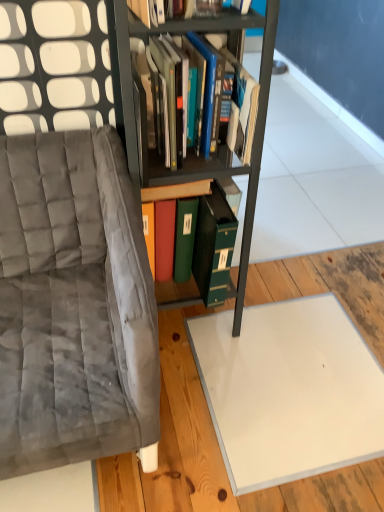
Describe the element at coordinates (167, 200) in the screenshot. I see `green matte file at center, the second book viewed from the top` at that location.

What do you see at coordinates (188, 153) in the screenshot? The image size is (384, 512). I see `metallic black bookcase at center` at bounding box center [188, 153].

Find the location of `metallic black bookcase at center`. metallic black bookcase at center is located at coordinates (188, 153).

You are a GUI agent. You are given a task and a screenshot of the screen. Output one action in this format:
    pyautogui.click(x=<x>, y=<y>)
    Task: Click on the hardcover books at center, which ranks as the second book in bottom-to-top order
    This screenshot has height=512, width=384.
    Given the screenshot: What is the action you would take?
    pyautogui.click(x=236, y=99)

At what (x,y) coordinates should I click in order to perform the action: click on green matte file at center, the 1th book in the bottom-to-top sequence. Please return your answer as a coordinate pair (x, y). Looking at the image, I should click on 167,200.

Is point (160, 177) behind point (151, 204)?

No, it is in front of (151, 204).

Considering the relative sizes of metallic black bookcase at center and green matte file at center, the second book viewed from the top, in the image provided, is metallic black bookcase at center taller than green matte file at center, the second book viewed from the top,?

Correct, metallic black bookcase at center is much taller as green matte file at center, the second book viewed from the top.

Consider the image. From a real-world perspective, is metallic black bookcase at center located beneath green matte file at center, the 1th book in the bottom-to-top sequence?

Incorrect, from a real-world perspective, metallic black bookcase at center is higher than green matte file at center, the 1th book in the bottom-to-top sequence.

Can you confirm if green matte file at center, the second book viewed from the top, is thinner than hardcover books at center, which ranks as the second book in bottom-to-top order?

Incorrect, the width of green matte file at center, the second book viewed from the top, is not less than that of hardcover books at center, which ranks as the second book in bottom-to-top order.

Does green matte file at center, the second book viewed from the top, have a greater height compared to hardcover books at center, which ranks as the second book in bottom-to-top order?

Result: Yes, green matte file at center, the second book viewed from the top, is taller than hardcover books at center, which ranks as the second book in bottom-to-top order.

How many degrees apart are the facing directions of green matte file at center, the 1th book in the bottom-to-top sequence, and hardcover books at center, the 1th book in the top-to-bottom sequence?

The facing directions of green matte file at center, the 1th book in the bottom-to-top sequence, and hardcover books at center, the 1th book in the top-to-bottom sequence, are 0.000184 degrees apart.

Can you see green matte file at center, the second book viewed from the top, touching hardcover books at center, the 1th book in the top-to-bottom sequence?

green matte file at center, the second book viewed from the top, is not next to hardcover books at center, the 1th book in the top-to-bottom sequence, and they're not touching.

Is metallic black bookcase at center directly adjacent to hardcover books at center, the 1th book in the top-to-bottom sequence?

No, metallic black bookcase at center is not in contact with hardcover books at center, the 1th book in the top-to-bottom sequence.

How different are the orientations of metallic black bookcase at center and hardcover books at center, which ranks as the second book in bottom-to-top order, in degrees?

0.718 degrees.

Could you tell me if metallic black bookcase at center is turned towards hardcover books at center, the 1th book in the top-to-bottom sequence?

Yes, metallic black bookcase at center is turned towards hardcover books at center, the 1th book in the top-to-bottom sequence.

Between point (243, 228) and point (195, 41), which one is positioned in front?

The point (195, 41) is more forward.

From the metallic black bookcase at center, count 2nd books backward and point to it. Please provide its 2D coordinates.

[(167, 200)]

Can you confirm if green matte file at center, the second book viewed from the top, is smaller than metallic black bookcase at center?

Yes.

Which object is closer to the camera taking this photo, green matte file at center, the 1th book in the bottom-to-top sequence, or metallic black bookcase at center?

metallic black bookcase at center.

Is green matte file at center, the 1th book in the bottom-to-top sequence, next to metallic black bookcase at center?

No, green matte file at center, the 1th book in the bottom-to-top sequence, is not making contact with metallic black bookcase at center.

Are hardcover books at center, which ranks as the second book in bottom-to-top order, and velvet gray chair at left far apart?

They are positioned close to each other.

Looking at this image, which of these two, hardcover books at center, which ranks as the second book in bottom-to-top order, or velvet gray chair at left, stands taller?

velvet gray chair at left.

Could you tell me if hardcover books at center, the 1th book in the top-to-bottom sequence, is facing velvet gray chair at left?

No, hardcover books at center, the 1th book in the top-to-bottom sequence, is not aimed at velvet gray chair at left.

From a real-world perspective, does hardcover books at center, the 1th book in the top-to-bottom sequence, sit lower than velvet gray chair at left?

No, from a real-world perspective, hardcover books at center, the 1th book in the top-to-bottom sequence, is not under velvet gray chair at left.

From the image's perspective, is green matte file at center, the 1th book in the bottom-to-top sequence, located beneath velvet gray chair at left?

No, from the image's perspective, green matte file at center, the 1th book in the bottom-to-top sequence, is not beneath velvet gray chair at left.

Measure the distance from green matte file at center, the second book viewed from the top, to velvet gray chair at left.

12.97 inches.

Is green matte file at center, the second book viewed from the top, surrounding velvet gray chair at left?

No, velvet gray chair at left is not a part of green matte file at center, the second book viewed from the top.

Does green matte file at center, the 1th book in the bottom-to-top sequence, come in front of velvet gray chair at left?

No.

The width and height of the screenshot is (384, 512). Find the location of `chair lying on the left of green matte file at center, the 1th book in the bottom-to-top sequence`. chair lying on the left of green matte file at center, the 1th book in the bottom-to-top sequence is located at coordinates (70, 252).

Between point (13, 152) and point (200, 194), which one is positioned in front?

Positioned in front is point (13, 152).

Is green matte file at center, the 1th book in the bottom-to-top sequence, at the back of velvet gray chair at left?

No, green matte file at center, the 1th book in the bottom-to-top sequence, is not at the back of velvet gray chair at left.

The image size is (384, 512). In order to click on book below the metallic black bookcase at center (from the image's perspective) in this screenshot , I will do `click(167, 200)`.

Where is `book that appears behind the hardcover books at center, which ranks as the second book in bottom-to-top order`? The image size is (384, 512). book that appears behind the hardcover books at center, which ranks as the second book in bottom-to-top order is located at coordinates (167, 200).

Based on the photo, from the image, which object appears to be nearer to green matte file at center, the 1th book in the bottom-to-top sequence, metallic black bookcase at center or hardcover books at center, the 1th book in the top-to-bottom sequence?

metallic black bookcase at center lies closer to green matte file at center, the 1th book in the bottom-to-top sequence, than the other object.

Estimate the real-world distances between objects in this image. Which object is closer to metallic black bookcase at center, velvet gray chair at left or green matte file at center, the 1th book in the bottom-to-top sequence?

green matte file at center, the 1th book in the bottom-to-top sequence.

Based on the photo, considering their positions, is hardcover books at center, which ranks as the second book in bottom-to-top order, positioned further to green matte file at center, the 1th book in the bottom-to-top sequence, than metallic black bookcase at center?

hardcover books at center, which ranks as the second book in bottom-to-top order, is further to green matte file at center, the 1th book in the bottom-to-top sequence.

From the image, which object appears to be farther from green matte file at center, the 1th book in the bottom-to-top sequence, metallic black bookcase at center or velvet gray chair at left?

velvet gray chair at left lies further to green matte file at center, the 1th book in the bottom-to-top sequence, than the other object.

Considering their positions, is green matte file at center, the 1th book in the bottom-to-top sequence, positioned further to metallic black bookcase at center than hardcover books at center, the 1th book in the top-to-bottom sequence?

Among the two, green matte file at center, the 1th book in the bottom-to-top sequence, is located further to metallic black bookcase at center.

From the image, which object appears to be nearer to green matte file at center, the 1th book in the bottom-to-top sequence, hardcover books at center, which ranks as the second book in bottom-to-top order, or velvet gray chair at left?

Based on the image, hardcover books at center, which ranks as the second book in bottom-to-top order, appears to be nearer to green matte file at center, the 1th book in the bottom-to-top sequence.

Which object lies nearer to the anchor point metallic black bookcase at center, hardcover books at center, the 1th book in the top-to-bottom sequence, or green matte file at center, the second book viewed from the top?

The object closer to metallic black bookcase at center is hardcover books at center, the 1th book in the top-to-bottom sequence.

Which object lies nearer to the anchor point velvet gray chair at left, green matte file at center, the second book viewed from the top, or hardcover books at center, the 1th book in the top-to-bottom sequence?

green matte file at center, the second book viewed from the top.

This screenshot has height=512, width=384. In order to click on book between hardcover books at center, the 1th book in the top-to-bottom sequence, and velvet gray chair at left, in the vertical direction in this screenshot , I will do `click(167, 200)`.

Locate an element on the screen. The image size is (384, 512). bookcase located between velvet gray chair at left and green matte file at center, the second book viewed from the top, in the depth direction is located at coordinates (188, 153).

This screenshot has width=384, height=512. I want to click on bookcase between hardcover books at center, which ranks as the second book in bottom-to-top order, and velvet gray chair at left in the up-down direction, so click(x=188, y=153).

Where is `book between metallic black bookcase at center and green matte file at center, the second book viewed from the top, along the z-axis`? This screenshot has width=384, height=512. book between metallic black bookcase at center and green matte file at center, the second book viewed from the top, along the z-axis is located at coordinates (236, 99).